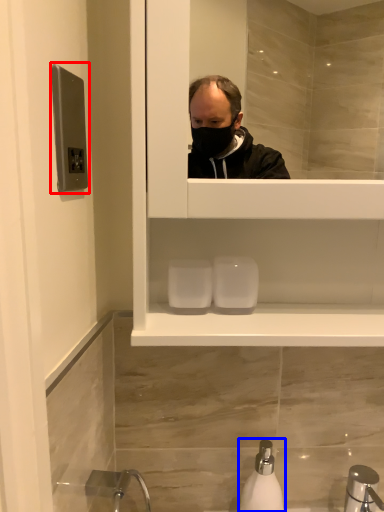
Question: Which point is further to the camera, door handle (highlighted by a red box) or soap dispenser (highlighted by a blue box)?

Choices:
 (A) door handle
 (B) soap dispenser

Answer: (B)